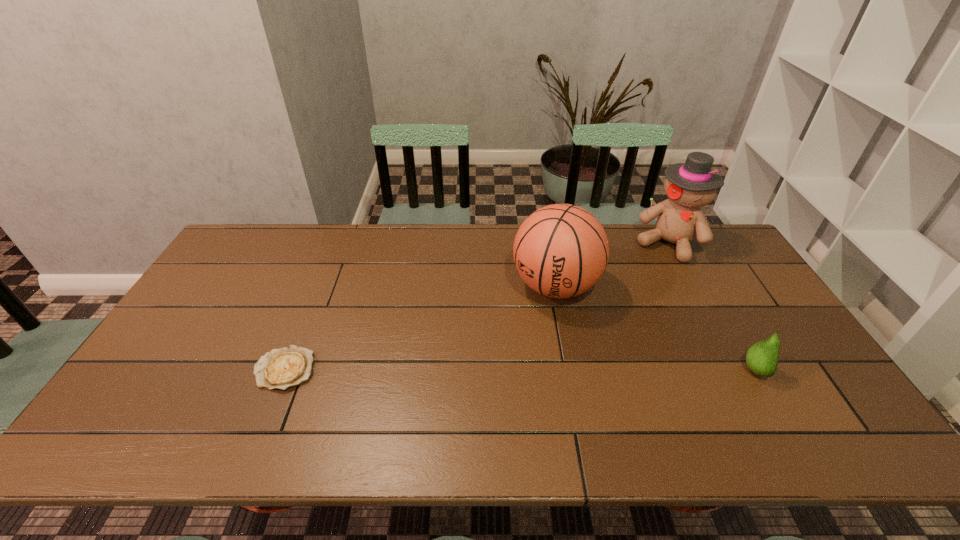
Find the location of a particular element. The image size is (960, 540). vacant point that satisfies the following two spatial constraints: 1. on the front side of the shortest object; 2. on the cut side of the third tallest object is located at coordinates point(283,371).

At what (x,y) coordinates should I click in order to perform the action: click on free location that satisfies the following two spatial constraints: 1. on the back side of the rag_doll; 2. on the left side of the basketball. Please return your answer as a coordinate pair (x, y). The height and width of the screenshot is (540, 960). Looking at the image, I should click on (547, 244).